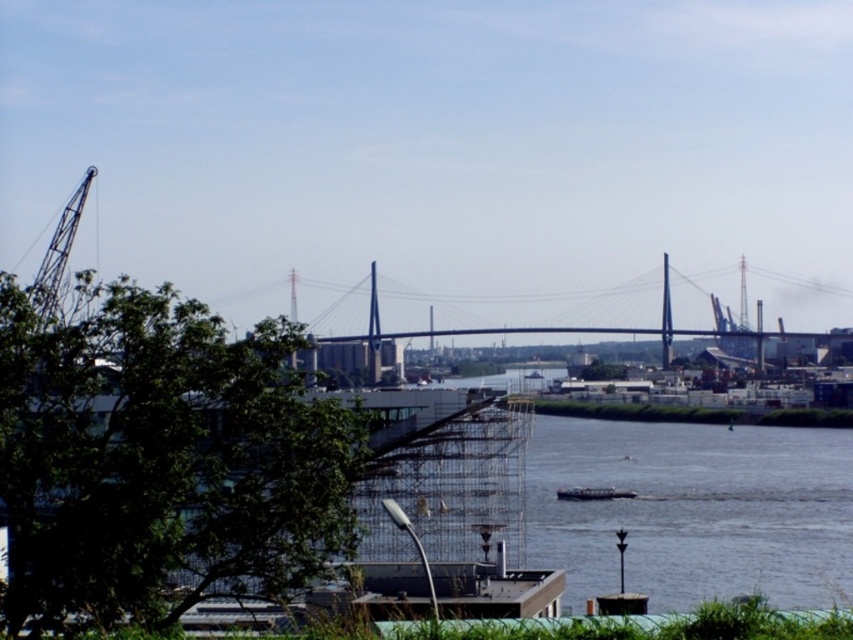
You are standing at the center of the image and want to reach the small boat on the right bank. Which direction should you move relative to the green leafy tree at center?

Since the green leafy tree at center is located at point (161, 460), you should move to the right and towards the bottom to reach the small boat on the right bank.

You are standing at the point labeled as point (57, 253) in the image. What object are you currently standing on?

You are standing on the metallic gray crane at left.

You are standing at the point marked by point (x=161, y=460). Looking around, you see a green leafy tree at center. What direction should you face to see the tree?

You are already facing the green leafy tree at center since you are standing at the point that marks its location.